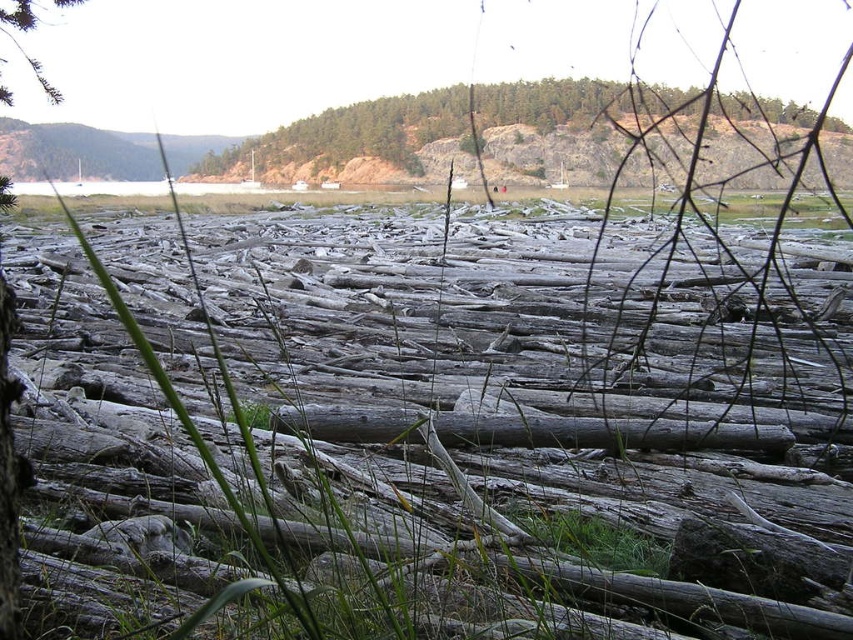
Between point (94, 528) and point (27, 61), which one is positioned in front?

Point (94, 528) is in front.

Find the location of a particular element. The width and height of the screenshot is (853, 640). green matte grass at center is located at coordinates (416, 433).

Between point (604, 625) and point (566, 129), which one is positioned behind?

Point (566, 129)

Between green matte grass at center and green textured hillside at upper center, which one appears on the right side from the viewer's perspective?

green textured hillside at upper center

Does point (134, 589) come farther from viewer compared to point (322, 125)?

No, it is in front of (322, 125).

Locate an element on the screen. green matte grass at center is located at coordinates (416, 433).

Is green textured hillside at upper center thinner than green matte tree at upper left?

Incorrect, green textured hillside at upper center's width is not less than green matte tree at upper left's.

The width and height of the screenshot is (853, 640). I want to click on green textured hillside at upper center, so click(x=439, y=125).

Locate an element on the screen. The width and height of the screenshot is (853, 640). green textured hillside at upper center is located at coordinates (439, 125).